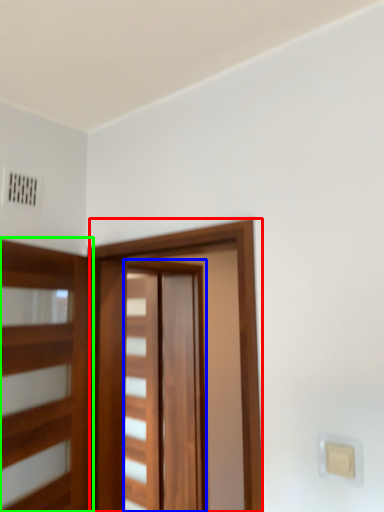
Question: Based on their relative distances, which object is nearer to barn door (highlighted by a red box)? Choose from barn door (highlighted by a blue box) and elevator (highlighted by a green box).

Choices:
 (A) barn door
 (B) elevator

Answer: (B)